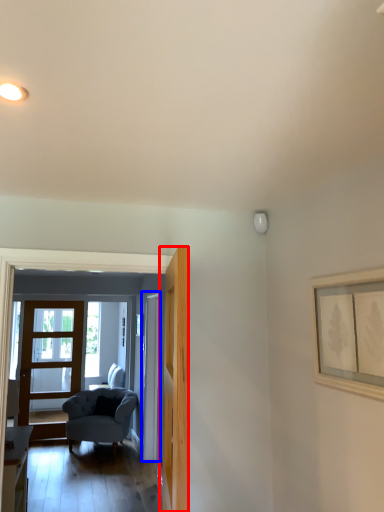
Question: Among these objects, which one is farthest to the camera, door (highlighted by a red box) or door (highlighted by a blue box)?

Choices:
 (A) door
 (B) door

Answer: (B)